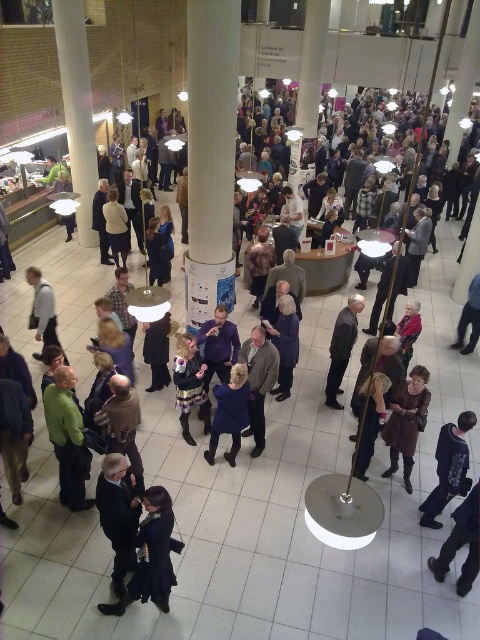
You are at a conference and need to locate your coat. You remember leaving a black fabric coat at lower left and a dark blue fabric coat at center. Which coat is positioned more to the left?

The black fabric coat at lower left is positioned to the left of the dark blue fabric coat at center, so the black fabric coat at lower left is more to the left.

You are a photographer at the event and want to capture both the dark blue suit at center and the dark blue sweater at center in a single frame. Considering their heights, which one might appear larger in the photo?

The dark blue suit at center is much taller than the dark blue sweater at center, so it will appear larger in the photo.

You are standing at the entrance of the conference hall and want to locate the person wearing the dark blue suit at center. Based on the coordinates provided, in which general direction should you look to find them?

The dark blue suit at center is located at coordinates point (119, 515), which means you should look towards the center of the hall slightly to the right and forward from the entrance.